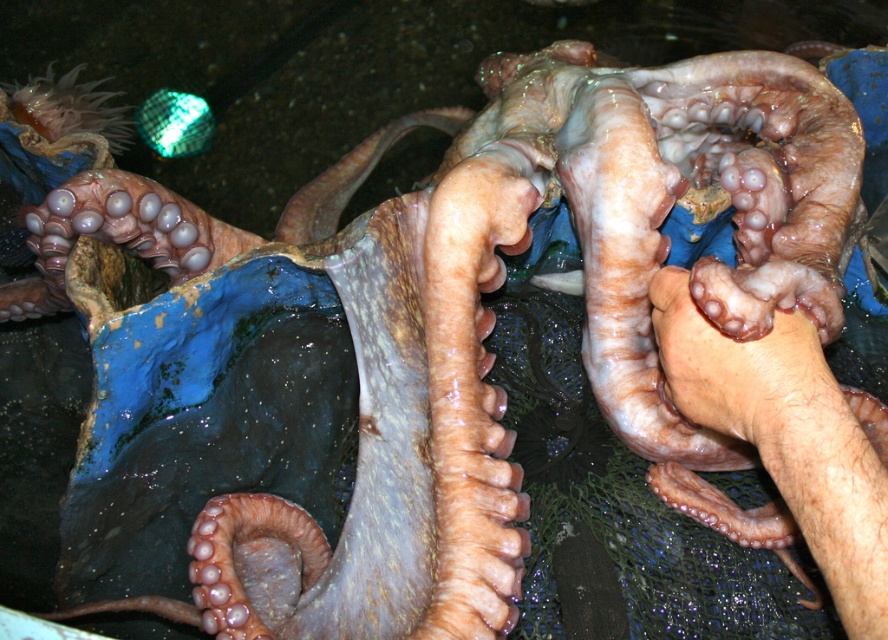
In order to click on smooth skin hand at center in this screenshot , I will do `click(786, 436)`.

Between point (668, 321) and point (664, 301), which one is positioned in front?

Point (668, 321) is in front.

Locate an element on the screen. smooth skin hand at center is located at coordinates (786, 436).